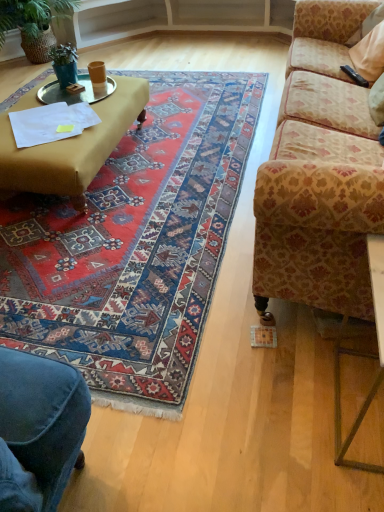
Locate an element on the screen. The height and width of the screenshot is (512, 384). vacant region in front of matte yellow ottoman at left is located at coordinates (101, 261).